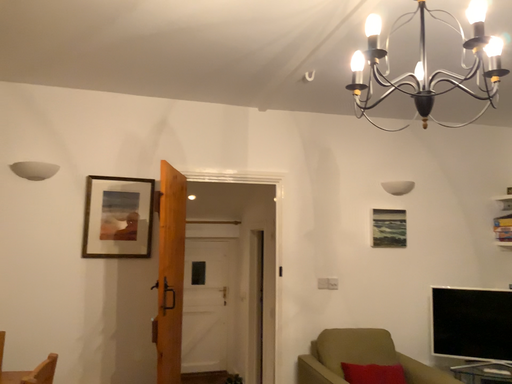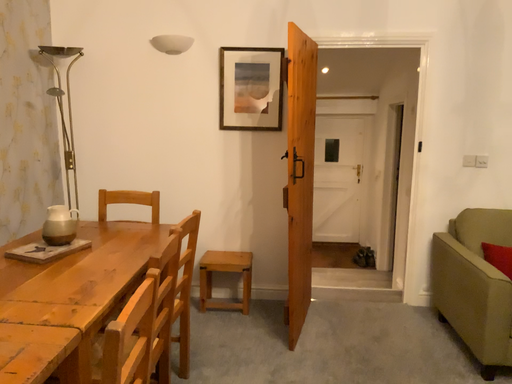
Question: Which way did the camera rotate in the video?

Choices:
 (A) rotated downward
 (B) rotated upward

Answer: (A)